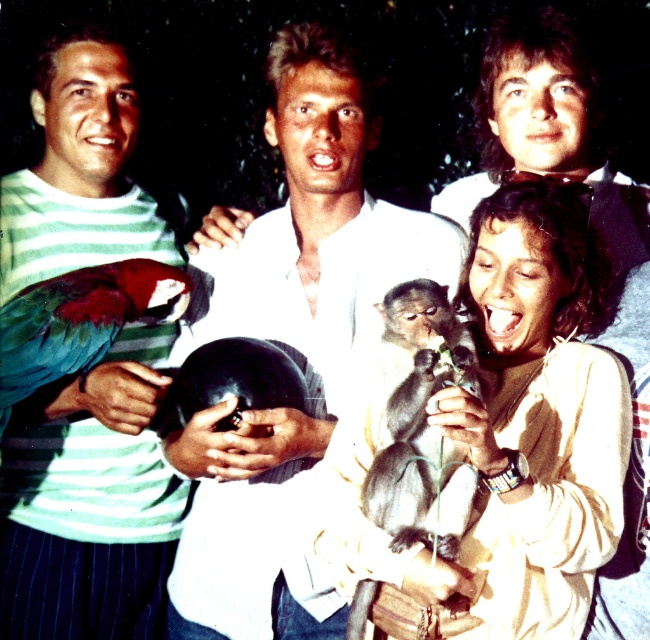
Question: Can you confirm if dark gray furry monkey at center is positioned to the left of green matte parrot at left?

Choices:
 (A) yes
 (B) no

Answer: (B)

Question: Which object is the closest to the dark gray furry monkey at center?

Choices:
 (A) green matte parrot at left
 (B) smooth beige sweater at center

Answer: (B)

Question: Which point appears farthest from the camera in this image?

Choices:
 (A) (31, 324)
 (B) (556, 588)
 (C) (47, 244)

Answer: (C)

Question: Can you confirm if smooth beige sweater at center is positioned below dark gray furry monkey at center?

Choices:
 (A) no
 (B) yes

Answer: (A)

Question: Which is farther from the green striped shirt at left?

Choices:
 (A) smooth beige sweater at center
 (B) dark gray furry monkey at center

Answer: (A)

Question: Does white matte shirt at center come behind smooth beige sweater at center?

Choices:
 (A) no
 (B) yes

Answer: (B)